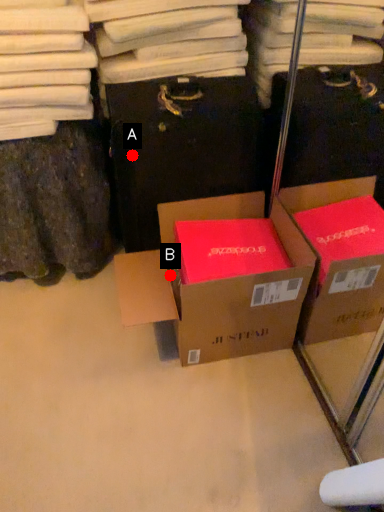
Question: Two points are circled on the image, labeled by A and B beside each circle. Among these points, which one is farthest from the camera?

Choices:
 (A) A is further
 (B) B is further

Answer: (B)